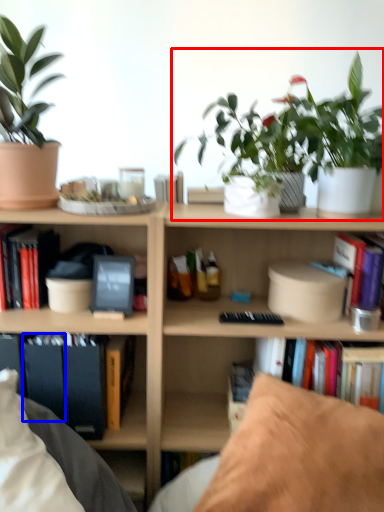
Question: Which object is closer to the camera taking this photo, houseplant (highlighted by a red box) or paperback book (highlighted by a blue box)?

Choices:
 (A) houseplant
 (B) paperback book

Answer: (A)